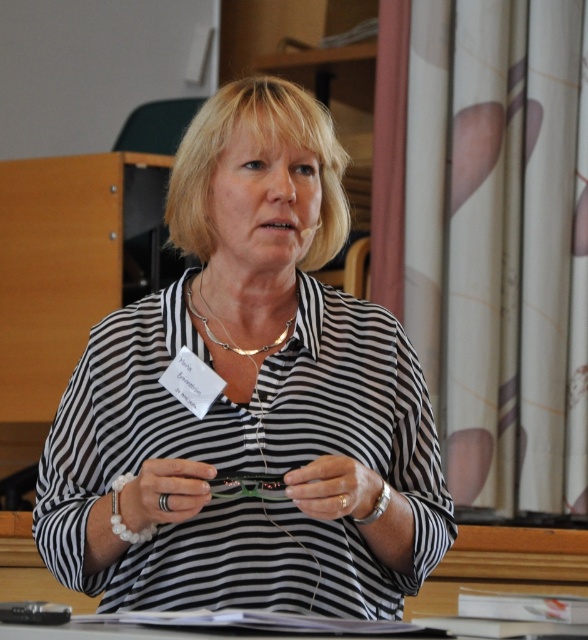
Can you confirm if black matte ring at center is taller than white matte bracelet at center?

Correct, black matte ring at center is much taller as white matte bracelet at center.

Is black matte ring at center below white matte bracelet at center?

Yes.

Where is `black matte ring at center`? This screenshot has height=640, width=588. black matte ring at center is located at coordinates (163, 492).

The width and height of the screenshot is (588, 640). Find the location of `black matte ring at center`. black matte ring at center is located at coordinates (163, 492).

Does point (185, 627) come in front of point (218, 320)?

Yes, point (185, 627) is in front of point (218, 320).

Which of these two, wooden table at lower center or silver metallic necklace at center, stands shorter?

Standing shorter between the two is wooden table at lower center.

Does point (129, 612) come closer to viewer compared to point (288, 326)?

Yes, point (129, 612) is in front of point (288, 326).

Where is `wooden table at lower center`? wooden table at lower center is located at coordinates pos(212,628).

Can you confirm if black striped shirt at center is wider than black matte ring at center?

Indeed, black striped shirt at center has a greater width compared to black matte ring at center.

Can you confirm if black striped shirt at center is positioned to the right of black matte ring at center?

Indeed, black striped shirt at center is positioned on the right side of black matte ring at center.

Image resolution: width=588 pixels, height=640 pixels. I want to click on black striped shirt at center, so click(x=249, y=394).